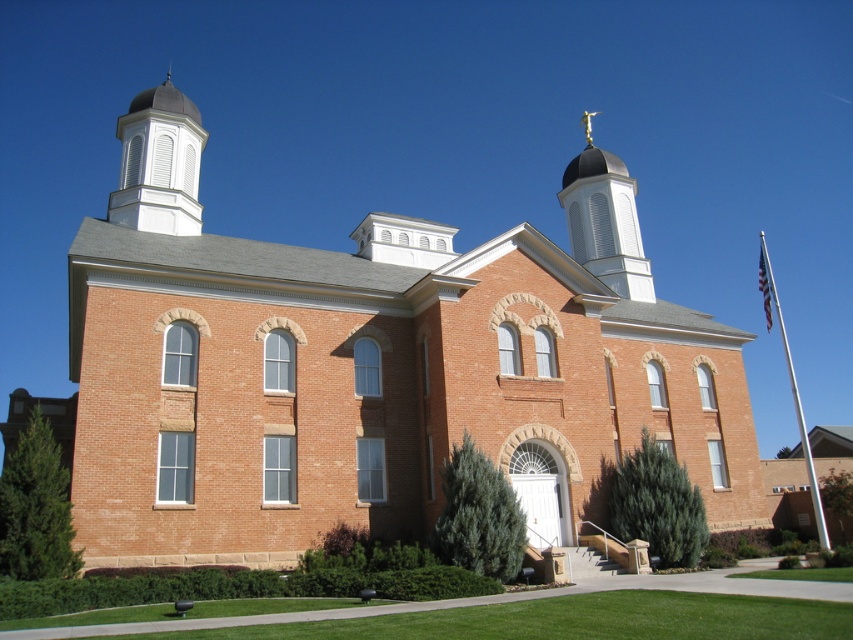
You are standing in front of the brick church at center and want to reach the white metallic flag pole at right. Which direction should you walk to get closer to the flag pole?

Since the brick church at center is closer to the viewer than the white metallic flag pole at right, you should walk forward away from the church towards the flag pole to get closer to it.

You are standing in front of the brick church at center and want to take a photo that includes both it and the white metallic flag pole at right. Based on their sizes in the image, which object should you position closer to the center of the photo to ensure both fit comfortably?

The brick church at center occupies less space than the white metallic flag pole at right, so you should position the brick church at center closer to the center of the photo to ensure both fit comfortably.

You are a photographer planning to take a symmetrical shot of the historic building. You want to ensure that the white wood cupola at upper left and the white metallic flag pole at right are both visible in the frame. Given their sizes, which object might require you to adjust your camera angle to include it fully in the photo?

The white wood cupola at upper left has a smaller size compared to the white metallic flag pole at right, so it might be easier to include the smaller cupola in the frame without adjusting the camera angle. However, the larger flag pole at right may require adjusting the camera angle to ensure it fits entirely within the photo.